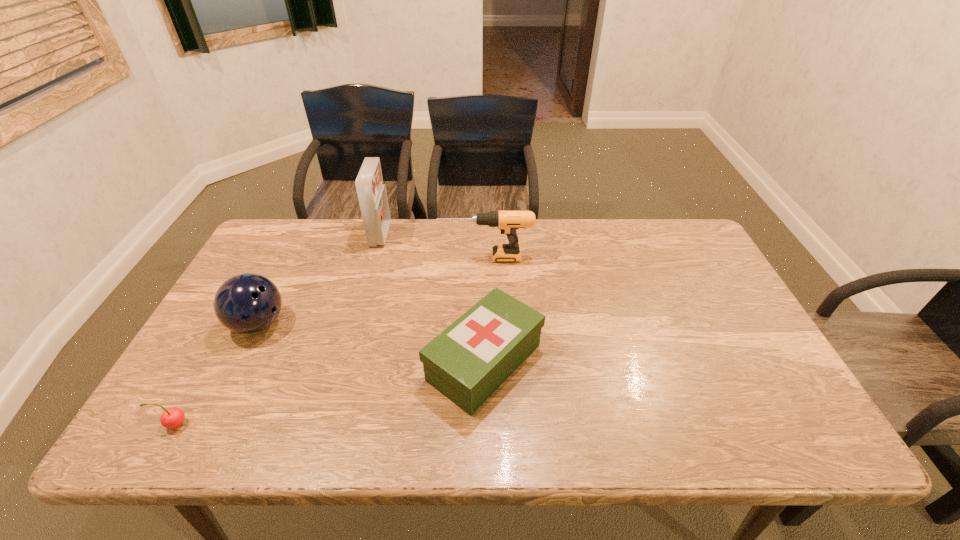
Find the location of `the tallest object`. the tallest object is located at coordinates (372, 195).

Where is `the farthest object`? the farthest object is located at coordinates (372, 195).

Find the location of a particular element. This screenshot has width=960, height=540. drill is located at coordinates (508, 222).

This screenshot has height=540, width=960. Identify the location of bowling ball. (247, 303).

Find the location of a particular element. The image size is (960, 540). the shorter first-aid kit is located at coordinates (467, 362).

The image size is (960, 540). Identify the location of the right first-aid kit. (467, 362).

Locate an element on the screen. This screenshot has height=540, width=960. the shortest object is located at coordinates (171, 418).

Locate an element on the screen. This screenshot has width=960, height=540. vacant space located 0.190m on the front-facing side of the third object from right to left is located at coordinates (444, 234).

Find the location of a particular element. Image resolution: width=960 pixels, height=540 pixels. vacant space located on the handle side of the drill is located at coordinates (423, 257).

This screenshot has width=960, height=540. In order to click on vacant space located 0.310m on the handle side of the drill in this screenshot , I will do `click(341, 257)`.